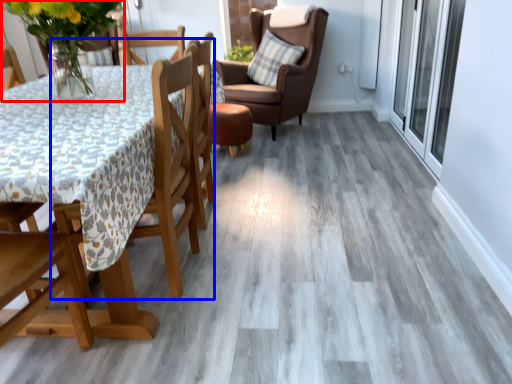
Question: Among these objects, which one is farthest to the camera, floral arrangement (highlighted by a red box) or chair (highlighted by a blue box)?

Choices:
 (A) floral arrangement
 (B) chair

Answer: (A)